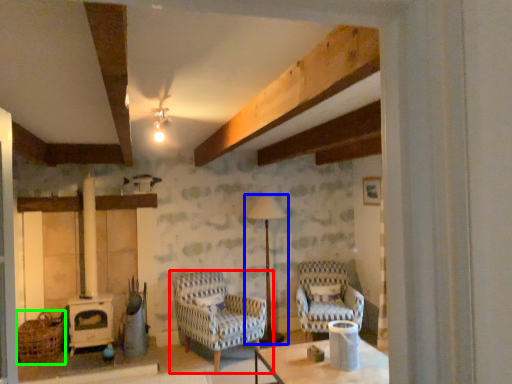
Question: Which is nearer to the chair (highlighted by a red box)? lamp (highlighted by a blue box) or basket (highlighted by a green box).

Choices:
 (A) lamp
 (B) basket

Answer: (A)